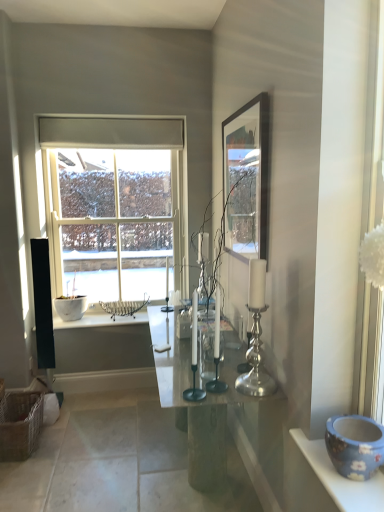
Question: Is silver metallic candle holder at center-right, acting as the third candle holder starting from the left, bigger than polished glass table at center?

Choices:
 (A) no
 (B) yes

Answer: (A)

Question: Is the position of silver metallic candle holder at center-right, acting as the third candle holder starting from the left, more distant than that of polished glass table at center?

Choices:
 (A) yes
 (B) no

Answer: (B)

Question: Is silver metallic candle holder at center-right, the first candle holder in the right-to-left sequence, next to polished glass table at center and touching it?

Choices:
 (A) yes
 (B) no

Answer: (B)

Question: Can you confirm if silver metallic candle holder at center-right, the first candle holder in the right-to-left sequence, is thinner than polished glass table at center?

Choices:
 (A) yes
 (B) no

Answer: (A)

Question: Does silver metallic candle holder at center-right, acting as the third candle holder starting from the left, appear on the right side of polished glass table at center?

Choices:
 (A) no
 (B) yes

Answer: (B)

Question: Could you tell me if silver metallic candle holder at center-right, the first candle holder in the right-to-left sequence, is turned towards polished glass table at center?

Choices:
 (A) no
 (B) yes

Answer: (A)

Question: Is clear glass window at center looking in the opposite direction of silver metallic candle holder at center, the first candle holder from the left?

Choices:
 (A) no
 (B) yes

Answer: (A)

Question: From the image's perspective, is clear glass window at center beneath silver metallic candle holder at center, the third candle holder viewed from the right?

Choices:
 (A) yes
 (B) no

Answer: (B)

Question: Is the depth of clear glass window at center greater than that of silver metallic candle holder at center, the first candle holder from the left?

Choices:
 (A) no
 (B) yes

Answer: (B)

Question: Are clear glass window at center and silver metallic candle holder at center, the first candle holder from the left, far apart?

Choices:
 (A) yes
 (B) no

Answer: (A)

Question: Is clear glass window at center in front of silver metallic candle holder at center, the first candle holder from the left?

Choices:
 (A) yes
 (B) no

Answer: (B)

Question: Is clear glass window at center thinner than silver metallic candle holder at center, the third candle holder viewed from the right?

Choices:
 (A) no
 (B) yes

Answer: (A)

Question: Is clear glass window at center positioned far away from silver metallic candle holder at center, the second candle holder in the right-to-left sequence?

Choices:
 (A) yes
 (B) no

Answer: (A)